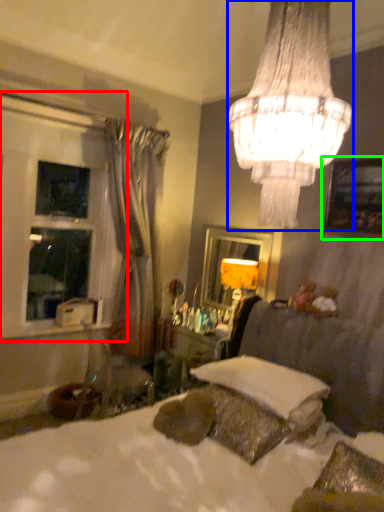
Question: Based on their relative distances, which object is nearer to bay window (highlighted by a red box)? Choose from lamp (highlighted by a blue box) and picture frame (highlighted by a green box).

Choices:
 (A) lamp
 (B) picture frame

Answer: (B)